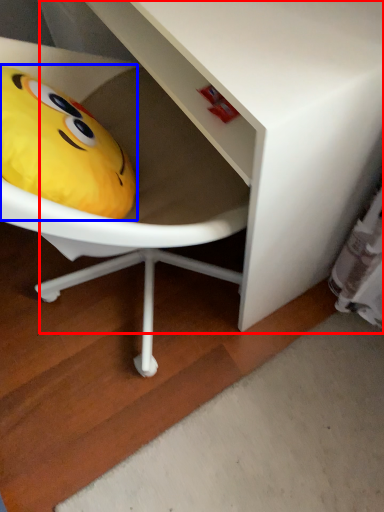
Question: Which of the following is the farthest to the observer, vanity (highlighted by a red box) or toy (highlighted by a blue box)?

Choices:
 (A) vanity
 (B) toy

Answer: (B)